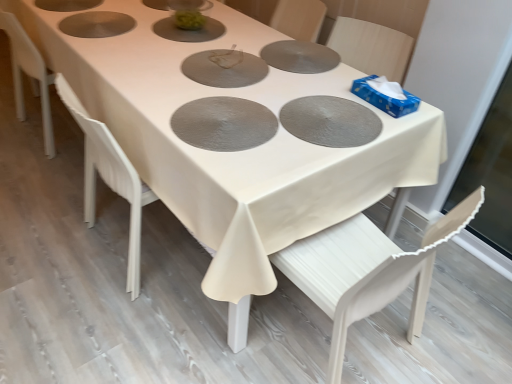
The width and height of the screenshot is (512, 384). Identify the location of free space to the back side of textured silver pizza pan at center, which is counted as the third pizza pan, starting from the top. (232, 81).